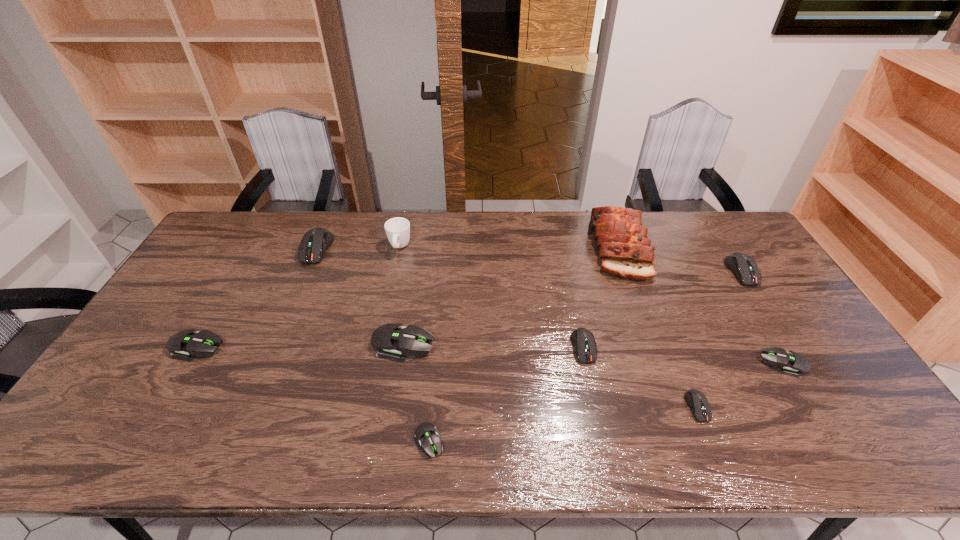
The height and width of the screenshot is (540, 960). In the image, there is a desktop. In order to click on free space at the far left corner in this screenshot , I will do `click(228, 232)`.

Identify the location of empty space between the fourth computer mouse from right to left and the second nearest object. (640, 377).

Find the location of `vacant space that's between the biggest gray computer mouse and the second biggest dark computer equipment`. vacant space that's between the biggest gray computer mouse and the second biggest dark computer equipment is located at coordinates (572, 308).

This screenshot has width=960, height=540. I want to click on unoccupied area between the cup and the tallest object, so click(x=509, y=247).

This screenshot has width=960, height=540. In order to click on free space between the tallest object and the third smallest gray computer mouse in this screenshot , I will do `click(408, 297)`.

Where is `free spot between the smallest gray computer mouse and the smallest dark computer equipment`? The height and width of the screenshot is (540, 960). free spot between the smallest gray computer mouse and the smallest dark computer equipment is located at coordinates (563, 424).

At what (x,y) coordinates should I click in order to perform the action: click on vacant area between the rightmost gray computer mouse and the bread. Please return your answer as a coordinate pair (x, y). This screenshot has height=540, width=960. Looking at the image, I should click on (701, 306).

The width and height of the screenshot is (960, 540). Find the location of `vacant space in between the nearest dark computer equipment and the tallest object`. vacant space in between the nearest dark computer equipment and the tallest object is located at coordinates (658, 327).

Locate an element on the screen. The image size is (960, 540). empty space between the leftmost computer mouse and the third smallest dark computer equipment is located at coordinates (469, 309).

Locate an element on the screen. The height and width of the screenshot is (540, 960). free space between the second smallest gray computer mouse and the third dark computer equipment from right to left is located at coordinates click(x=684, y=356).